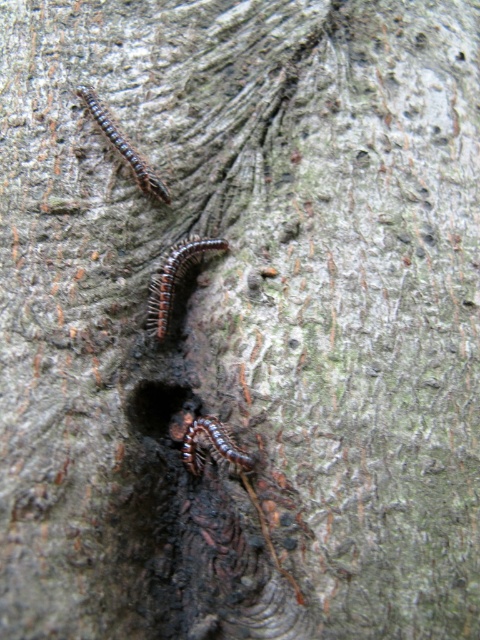
You are a biologist observing the tree trunk and need to identify which centipede is narrower between the brown shiny centipede at center and the brown scaly centipede at upper left. Which one is narrower?

The brown shiny centipede at center is narrower than the brown scaly centipede at upper left.